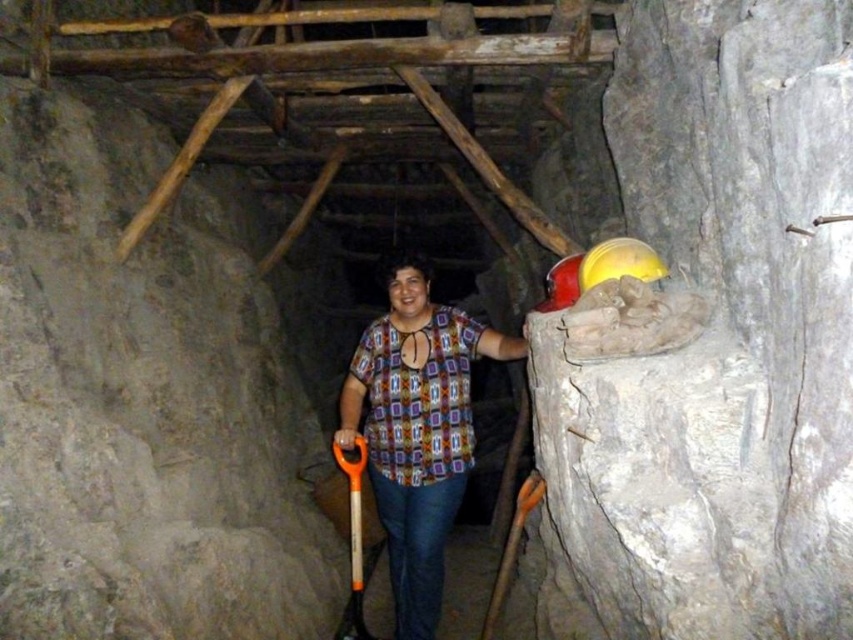
Question: Which point is closer to the camera taking this photo?

Choices:
 (A) (410, 481)
 (B) (498, 580)
 (C) (341, 628)

Answer: (A)

Question: Can you confirm if printed fabric shirt at center is positioned to the right of orange plastic shovel at center?

Choices:
 (A) no
 (B) yes

Answer: (B)

Question: Which point is farther to the camera?

Choices:
 (A) (401, 548)
 (B) (537, 499)

Answer: (A)

Question: Which object is closer to the camera taking this photo?

Choices:
 (A) orange plastic shovel at lower center
 (B) printed fabric shirt at center

Answer: (A)

Question: Is orange plastic shovel at center further to the viewer compared to orange plastic shovel at lower center?

Choices:
 (A) yes
 (B) no

Answer: (A)

Question: Can you confirm if printed fabric shirt at center is wider than orange plastic shovel at center?

Choices:
 (A) yes
 (B) no

Answer: (A)